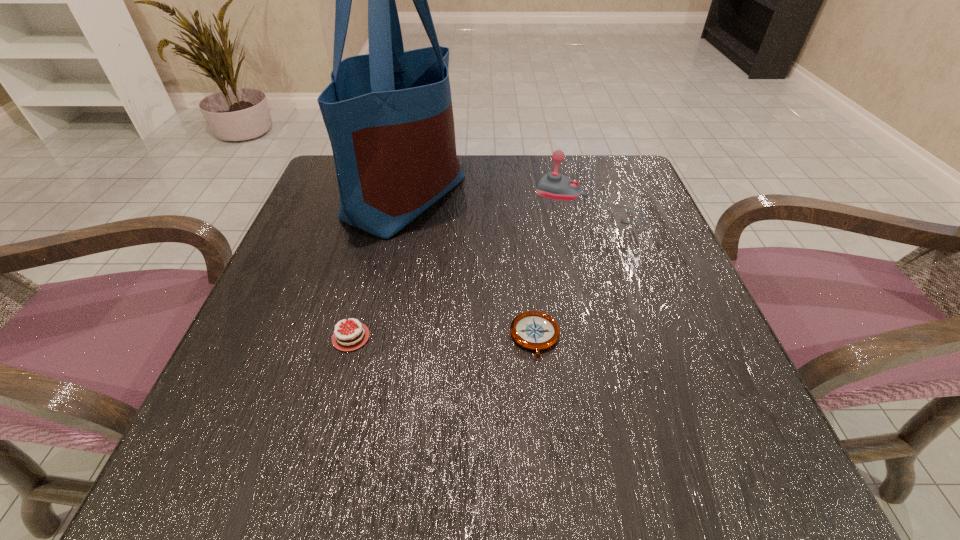
The image size is (960, 540). In order to click on free spot between the second tallest object and the third tallest object in this screenshot , I will do `click(470, 271)`.

The width and height of the screenshot is (960, 540). I want to click on object that is the third closest to the tallest object, so click(x=534, y=330).

Where is `object that ranks as the closest to the tallest object`? The image size is (960, 540). object that ranks as the closest to the tallest object is located at coordinates (554, 185).

Where is `vacant space that satisfies the following two spatial constraints: 1. on the back side of the joystick; 2. on the left side of the chocolate cake`? The image size is (960, 540). vacant space that satisfies the following two spatial constraints: 1. on the back side of the joystick; 2. on the left side of the chocolate cake is located at coordinates [x=386, y=204].